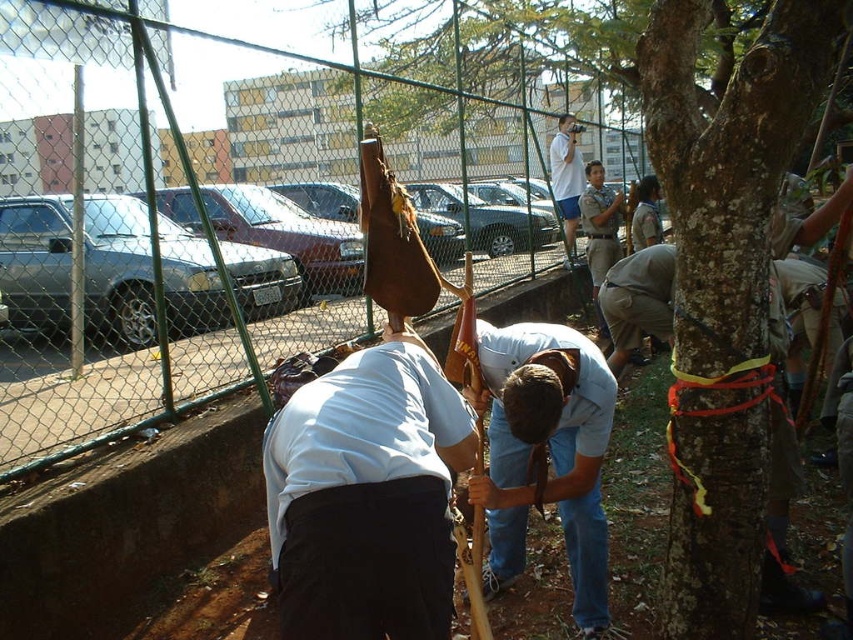
Question: Can you confirm if white matte shirt at center is positioned to the right of light blue denim jeans at center?

Choices:
 (A) no
 (B) yes

Answer: (A)

Question: Which object is the farthest from the light blue denim jeans at center?

Choices:
 (A) green chain-link fence at center
 (B) smooth bark tree at center
 (C) white matte shirt at center

Answer: (A)

Question: Is light blue denim jeans at center smaller than white matte shirt at upper center?

Choices:
 (A) no
 (B) yes

Answer: (B)

Question: Estimate the real-world distances between objects in this image. Which object is closer to the green chain-link fence at center?

Choices:
 (A) smooth bark tree at center
 (B) light blue denim jeans at center

Answer: (B)

Question: Is white matte shirt at center to the left of white matte shirt at upper center from the viewer's perspective?

Choices:
 (A) yes
 (B) no

Answer: (A)

Question: Estimate the real-world distances between objects in this image. Which object is closer to the white matte shirt at center?

Choices:
 (A) white matte shirt at upper center
 (B) light blue denim jeans at center
 (C) smooth bark tree at center

Answer: (B)